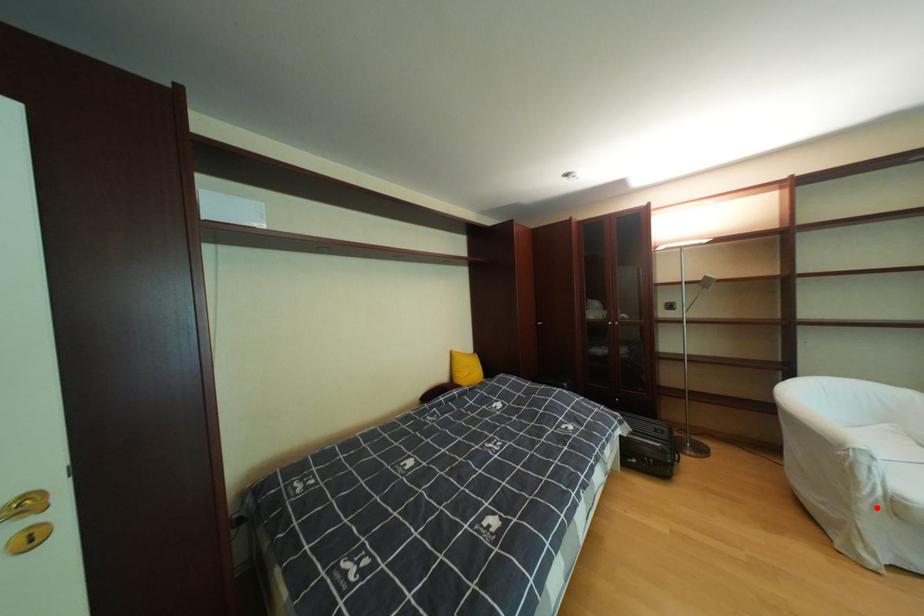
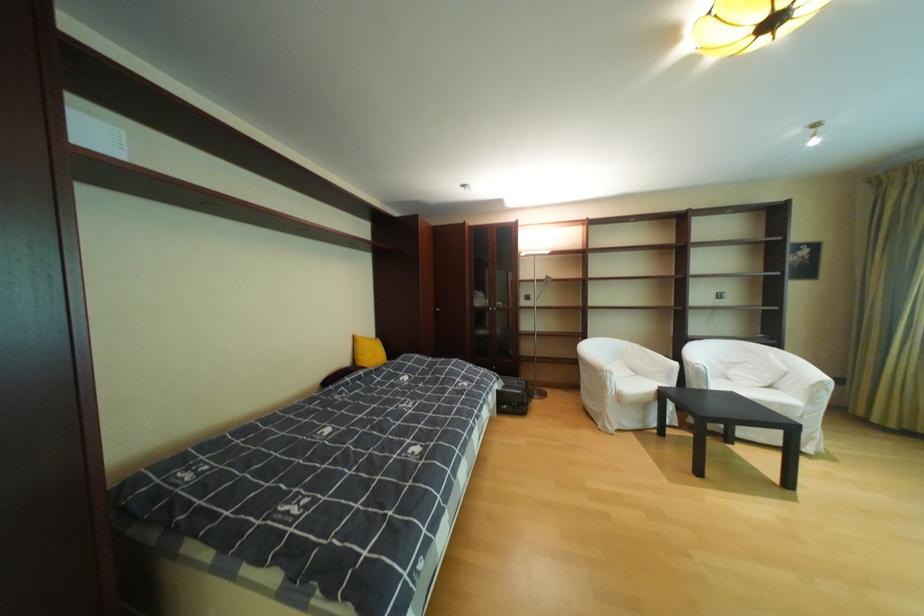
Where in the second image is the point corresponding to the highlighted location from the first image?

(621, 402)